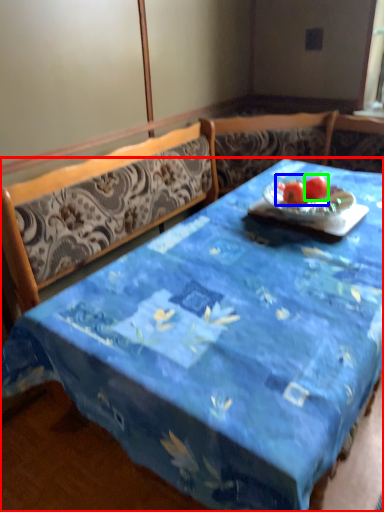
Question: Based on their relative distances, which object is nearer to desk (highlighted by a red box)? Choose from fruit (highlighted by a blue box) and tomato (highlighted by a green box).

Choices:
 (A) fruit
 (B) tomato

Answer: (A)